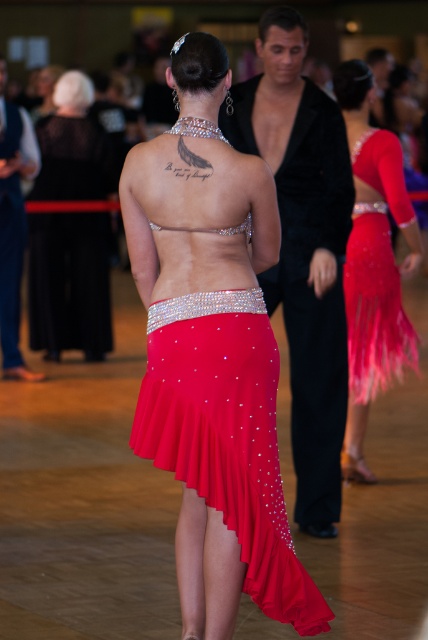
Question: Which point is closer to the camera?

Choices:
 (A) (243, 536)
 (B) (74, 253)
 (C) (389, 205)

Answer: (A)

Question: Is the position of shiny satin skirt at center less distant than that of matte black dress at center?

Choices:
 (A) no
 (B) yes

Answer: (B)

Question: In this image, where is shiny satin skirt at center located relative to matte black dress at center?

Choices:
 (A) left
 (B) right

Answer: (B)

Question: Among these points, which one is farthest from the camera?

Choices:
 (A) (154, 305)
 (B) (350, 372)

Answer: (B)

Question: Does shiny satin skirt at center lie behind shiny sequined skirt at center?

Choices:
 (A) no
 (B) yes

Answer: (A)

Question: Which is nearer to the shiny sequined skirt at center?

Choices:
 (A) shiny satin skirt at center
 (B) matte black dress at center

Answer: (A)